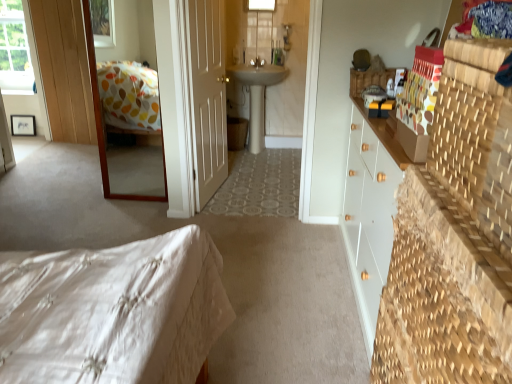
You are a GUI agent. You are given a task and a screenshot of the screen. Output one action in this format:
    pyautogui.click(x=<x>, y=<y>)
    Task: Click on the vacant space to the right of white matte door at center
    
    Given the screenshot: What is the action you would take?
    pyautogui.click(x=258, y=197)